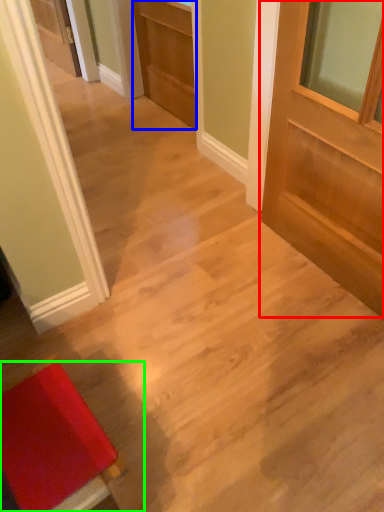
Question: Which is farther away from door (highlighted by a red box)? door (highlighted by a blue box) or furniture (highlighted by a green box)?

Choices:
 (A) door
 (B) furniture

Answer: (B)